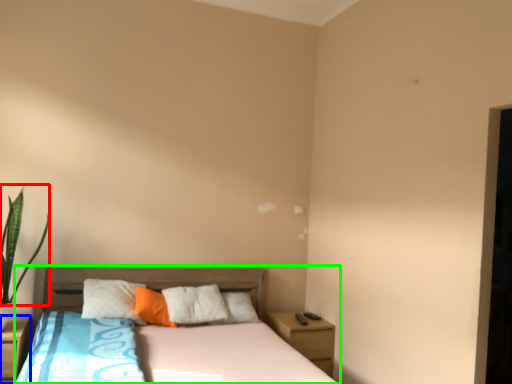
Question: Based on their relative distances, which object is nearer to plant (highlighted by a red box)? Choose from nightstand (highlighted by a blue box) and bed (highlighted by a green box).

Choices:
 (A) nightstand
 (B) bed

Answer: (A)